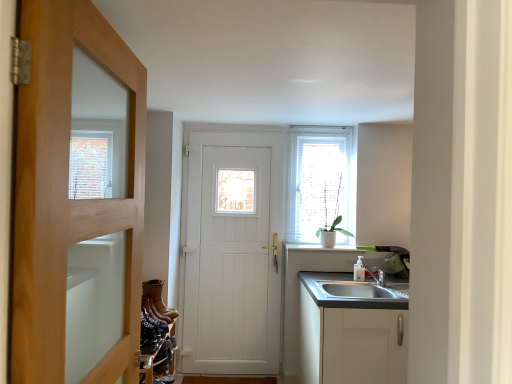
Measure the distance between point (72, 0) and camera.

They are 33.78 inches apart.

You are a GUI agent. You are given a task and a screenshot of the screen. Output one action in this format:
    pyautogui.click(x=<x>, y=<y>)
    Task: Click on the white textured window at upper right
    
    Given the screenshot: What is the action you would take?
    pyautogui.click(x=319, y=182)

This screenshot has height=384, width=512. What do you see at coordinates (164, 379) in the screenshot?
I see `leather boot at lower left, which appears as the 1th shoe when ordered from the bottom` at bounding box center [164, 379].

This screenshot has width=512, height=384. What are the coordinates of `white wooden door at center, which appears as the second door when viewed from the front` in the screenshot? It's located at (233, 253).

Identify the location of plant above the leather boots at lower left, positioned as the 4th shoe in bottom-to-top order (from a real-world perspective). The image size is (512, 384). (332, 222).

From the picture: From a real-world perspective, relative to white ceramic plant at upper right, is leather boots at lower left, the first shoe positioned from the top, vertically above or below?

Clearly, from a real-world perspective, leather boots at lower left, the first shoe positioned from the top, is below white ceramic plant at upper right.

Are leather boots at lower left, which ranks as the 4th shoe in front-to-back order, and white ceramic plant at upper right beside each other?

No, leather boots at lower left, which ranks as the 4th shoe in front-to-back order, is not making contact with white ceramic plant at upper right.

Looking at their sizes, would you say leather boots at lower left, which ranks as the 4th shoe in front-to-back order, is wider or thinner than white ceramic plant at upper right?

Clearly, leather boots at lower left, which ranks as the 4th shoe in front-to-back order, has less width compared to white ceramic plant at upper right.

From the image's perspective, is leather boot at lower left, which is counted as the third shoe, starting from the back, positioned above or below brown suede boot at lower left, which is the second shoe in back-to-front order?

leather boot at lower left, which is counted as the third shoe, starting from the back, is situated lower than brown suede boot at lower left, which is the second shoe in back-to-front order, in the image.

Is leather boot at lower left, which is the 2th shoe in front-to-back order, wider or thinner than brown suede boot at lower left, arranged as the third shoe when viewed from the front?

In the image, leather boot at lower left, which is the 2th shoe in front-to-back order, appears to be more narrow than brown suede boot at lower left, arranged as the third shoe when viewed from the front.

Can you confirm if leather boot at lower left, the fourth shoe from the top, is positioned to the right of brown suede boot at lower left, which is counted as the second shoe, starting from the top?

Indeed, leather boot at lower left, the fourth shoe from the top, is positioned on the right side of brown suede boot at lower left, which is counted as the second shoe, starting from the top.

Considering their positions, is leather boot at lower left, the fourth shoe from the top, located in front of or behind brown suede boot at lower left, arranged as the third shoe when viewed from the front?

leather boot at lower left, the fourth shoe from the top, is positioned closer to the viewer than brown suede boot at lower left, arranged as the third shoe when viewed from the front.

Is point (159, 325) less distant than point (348, 170)?

Yes, it is.

Consider the image. From a real-world perspective, which is physically above, leather at lower left, which appears as the fourth shoe when viewed from the back, or white textured window at upper right?

From a 3D spatial view, white textured window at upper right is above.

Can you tell me how much leather at lower left, which appears as the fourth shoe when viewed from the back, and white textured window at upper right differ in facing direction?

84.6 degrees separate the facing orientations of leather at lower left, which appears as the fourth shoe when viewed from the back, and white textured window at upper right.

You are a GUI agent. You are given a task and a screenshot of the screen. Output one action in this format:
    pyautogui.click(x=<x>, y=<y>)
    Task: Click on the window on the right of leather at lower left, which appears as the fourth shoe when viewed from the back
    This screenshot has height=384, width=512.
    Given the screenshot: What is the action you would take?
    pyautogui.click(x=319, y=182)

At what (x,y) coordinates should I click in order to perform the action: click on door that is the 2nd one below the white textured window at upper right (from a real-world perspective). Please return your answer as a coordinate pair (x, y). Looking at the image, I should click on (233, 253).

Who is shorter, white textured window at upper right or white wooden door at center, which appears as the second door when viewed from the front?

white textured window at upper right.

Considering the sizes of objects white textured window at upper right and white wooden door at center, which is the 1th door in back-to-front order, in the image provided, who is thinner, white textured window at upper right or white wooden door at center, which is the 1th door in back-to-front order,?

white textured window at upper right.

Considering the relative sizes of leather boot at lower left, which is counted as the third shoe, starting from the back, and leather at lower left, the 1th shoe viewed from the front, in the image provided, is leather boot at lower left, which is counted as the third shoe, starting from the back, thinner than leather at lower left, the 1th shoe viewed from the front,?

Yes.

In the scene shown: Based on their sizes in the image, would you say leather boot at lower left, the fourth shoe from the top, is bigger or smaller than leather at lower left, which appears as the fourth shoe when viewed from the back?

In the image, leather boot at lower left, the fourth shoe from the top, appears to be smaller than leather at lower left, which appears as the fourth shoe when viewed from the back.

Is leather boot at lower left, the fourth shoe from the top, taller or shorter than leather at lower left, which appears as the fourth shoe when viewed from the back?

Clearly, leather boot at lower left, the fourth shoe from the top, is shorter compared to leather at lower left, which appears as the fourth shoe when viewed from the back.

Can you tell me how much leather boot at lower left, which is counted as the third shoe, starting from the back, and leather at lower left, the 3th shoe positioned from the top, differ in facing direction?

12.6 degrees.

Is the surface of white ceramic plant at upper right in direct contact with leather boots at lower left, positioned as the 4th shoe in bottom-to-top order?

white ceramic plant at upper right is not next to leather boots at lower left, positioned as the 4th shoe in bottom-to-top order, and they're not touching.

Where is `plant above the leather boots at lower left, which ranks as the 4th shoe in front-to-back order (from a real-world perspective)`? The image size is (512, 384). plant above the leather boots at lower left, which ranks as the 4th shoe in front-to-back order (from a real-world perspective) is located at coordinates (332, 222).

Would you say white ceramic plant at upper right is outside leather boots at lower left, the first shoe when ordered from back to front?

Indeed, white ceramic plant at upper right is completely outside leather boots at lower left, the first shoe when ordered from back to front.

Can you confirm if white ceramic plant at upper right is wider than leather boots at lower left, the first shoe when ordered from back to front?

Yes.

Between point (149, 332) and point (306, 337), which one is positioned in front?

The point (149, 332) is more forward.

Does leather at lower left, which appears as the fourth shoe when viewed from the back, lie in front of white matte cabinet at lower right?

Yes.

How many degrees apart are the facing directions of leather at lower left, the 3th shoe positioned from the top, and white matte cabinet at lower right?

They differ by 84.7 degrees in their facing directions.

What are the coordinates of `the 1st shoe in front of the white ceramic plant at upper right` in the screenshot? It's located at (157, 297).

This screenshot has width=512, height=384. In order to click on the 2nd shoe positioned below the brown suede boot at lower left, which is counted as the second shoe, starting from the top (from the image's perspective) in this screenshot , I will do pos(164,379).

Which object lies further to the anchor point leather at lower left, the 1th shoe viewed from the front, leather boots at lower left, the first shoe when ordered from back to front, or white textured window at upper right?

white textured window at upper right is positioned further to the anchor leather at lower left, the 1th shoe viewed from the front.

Looking at the image, which one is located closer to leather at lower left, the 3th shoe positioned from the top, leather boots at lower left, the first shoe positioned from the top, or brown suede boot at lower left, which is counted as the second shoe, starting from the top?

brown suede boot at lower left, which is counted as the second shoe, starting from the top, is closer to leather at lower left, the 3th shoe positioned from the top.

From the image, which object appears to be farther from white textured window at upper right, white wooden door at center, which appears as the second door when viewed from the front, or white matte cabinet at lower right?

white matte cabinet at lower right lies further to white textured window at upper right than the other object.

Estimate the real-world distances between objects in this image. Which object is closer to leather at lower left, the 1th shoe viewed from the front, leather boot at lower left, which appears as the 1th shoe when ordered from the bottom, or white matte cabinet at lower right?

leather boot at lower left, which appears as the 1th shoe when ordered from the bottom.

Looking at the image, which one is located further to white wooden door at center, which is the 1th door in back-to-front order, leather at lower left, the 3th shoe positioned from the top, or leather boot at lower left, which is counted as the third shoe, starting from the back?

leather at lower left, the 3th shoe positioned from the top, is positioned further to the anchor white wooden door at center, which is the 1th door in back-to-front order.

Based on the photo, looking at the image, which one is located further to white matte cabinet at lower right, leather boots at lower left, positioned as the 4th shoe in bottom-to-top order, or brown suede boot at lower left, which is counted as the second shoe, starting from the top?

brown suede boot at lower left, which is counted as the second shoe, starting from the top, lies further to white matte cabinet at lower right than the other object.

Looking at the image, which one is located closer to wooden door at left, marked as the 2th door in a back-to-front arrangement, white wooden door at center, which is the 1th door in back-to-front order, or white matte cabinet at lower right?

white matte cabinet at lower right.

Based on their spatial positions, is white wooden door at center, which is the 1th door in back-to-front order, or wooden door at left, marked as the 2th door in a back-to-front arrangement, further from white ceramic plant at upper right?

Based on the image, wooden door at left, marked as the 2th door in a back-to-front arrangement, appears to be further to white ceramic plant at upper right.

You are a GUI agent. You are given a task and a screenshot of the screen. Output one action in this format:
    pyautogui.click(x=<x>, y=<y>)
    Task: Click on the window located between leather boots at lower left, the first shoe positioned from the top, and white matte cabinet at lower right in the left-right direction
    
    Given the screenshot: What is the action you would take?
    pyautogui.click(x=319, y=182)

Where is `shoe situated between leather boots at lower left, which ranks as the 4th shoe in front-to-back order, and white matte cabinet at lower right from left to right`? The height and width of the screenshot is (384, 512). shoe situated between leather boots at lower left, which ranks as the 4th shoe in front-to-back order, and white matte cabinet at lower right from left to right is located at coordinates (164, 379).

Identify the location of window located between leather boot at lower left, which is the 2th shoe in front-to-back order, and white ceramic plant at upper right in the left-right direction. click(319, 182).

Identify the location of plant between white matte cabinet at lower right and white wooden door at center, which appears as the second door when viewed from the front, in the front-back direction. Image resolution: width=512 pixels, height=384 pixels. point(332,222).